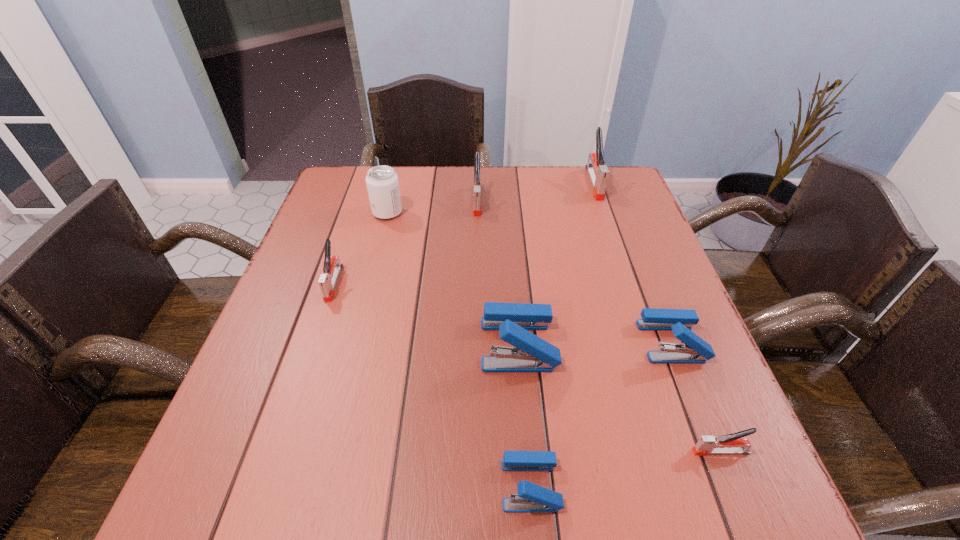
The image size is (960, 540). Find the location of `free region at the left edge of the desktop`. free region at the left edge of the desktop is located at coordinates (349, 256).

At what (x,y) coordinates should I click in order to perform the action: click on free location at the right edge. Please return your answer as a coordinate pair (x, y). Looking at the image, I should click on (595, 251).

Identify the location of vacant area at the far left corner. (349, 194).

Identify the location of vacant space at the near left corner of the desktop. (300, 472).

Where is `vacant space at the far right corner`? This screenshot has width=960, height=540. vacant space at the far right corner is located at coordinates (630, 185).

In the image, there is a desktop. Where is `free space at the near right corner`? This screenshot has width=960, height=540. free space at the near right corner is located at coordinates (746, 491).

You are a GUI agent. You are given a task and a screenshot of the screen. Output one action in this format:
    pyautogui.click(x=<x>, y=<y>)
    Task: Click on the empty space between the biggest blue stapler and the biggest gray stapler
    
    Given the screenshot: What is the action you would take?
    pyautogui.click(x=556, y=264)

Identify the location of blank region between the fifth nearest object and the tallest object. The height and width of the screenshot is (540, 960). point(464,233).

This screenshot has height=540, width=960. Identify the location of free point between the soda can and the biggest blue stapler. pos(453,278).

The width and height of the screenshot is (960, 540). Find the location of `free space between the biggest gray stapler and the second gray stapler from left to right`. free space between the biggest gray stapler and the second gray stapler from left to right is located at coordinates (536, 192).